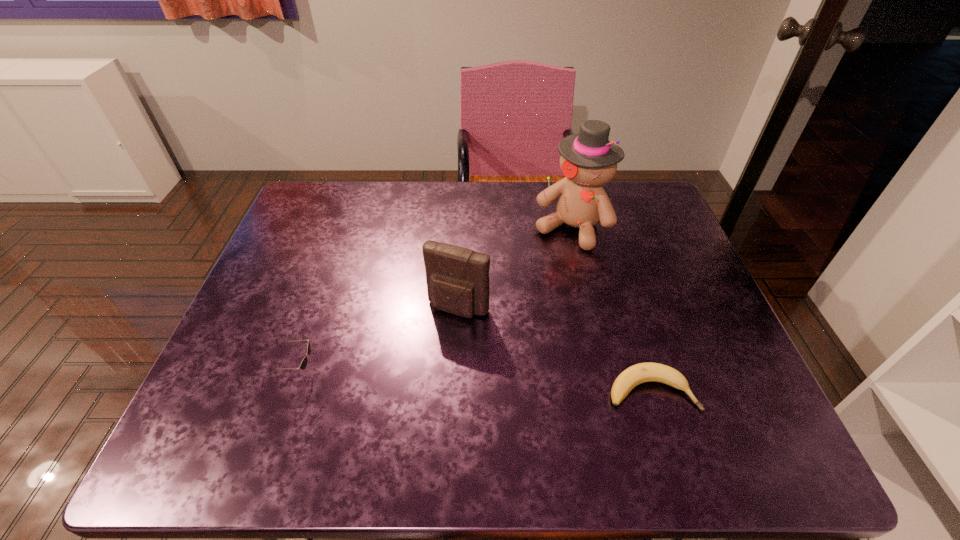
In order to click on sunglasses in this screenshot , I will do [303, 364].

Where is `the leftmost object`? the leftmost object is located at coordinates (303, 364).

The width and height of the screenshot is (960, 540). I want to click on banana, so click(643, 372).

This screenshot has width=960, height=540. Find the location of `rag_doll`. rag_doll is located at coordinates (588, 160).

Where is `the farthest object`? The image size is (960, 540). the farthest object is located at coordinates (588, 160).

Where is `the second object from left to right`? This screenshot has height=540, width=960. the second object from left to right is located at coordinates (457, 278).

Find the location of a particular element. the second farthest object is located at coordinates (457, 278).

Find the location of `blank area located 0.280m in front of the lenses of the leftmost object`. blank area located 0.280m in front of the lenses of the leftmost object is located at coordinates (448, 372).

At what (x,y) coordinates should I click in order to perform the action: click on free space located at the stem of the banana. Please return your answer as a coordinate pair (x, y). The width and height of the screenshot is (960, 540). Looking at the image, I should click on (740, 390).

Locate an element on the screen. free space located on the front-facing side of the farthest object is located at coordinates (544, 272).